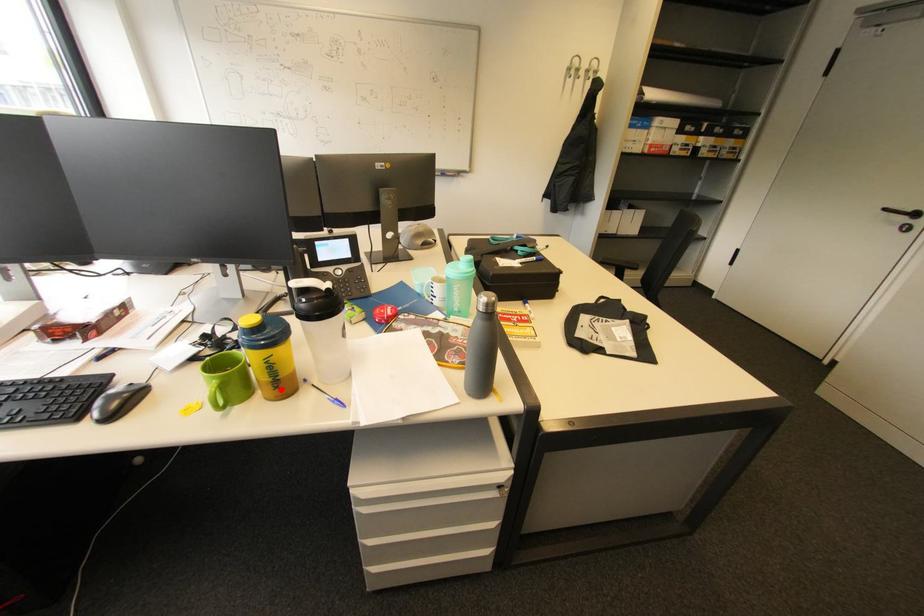
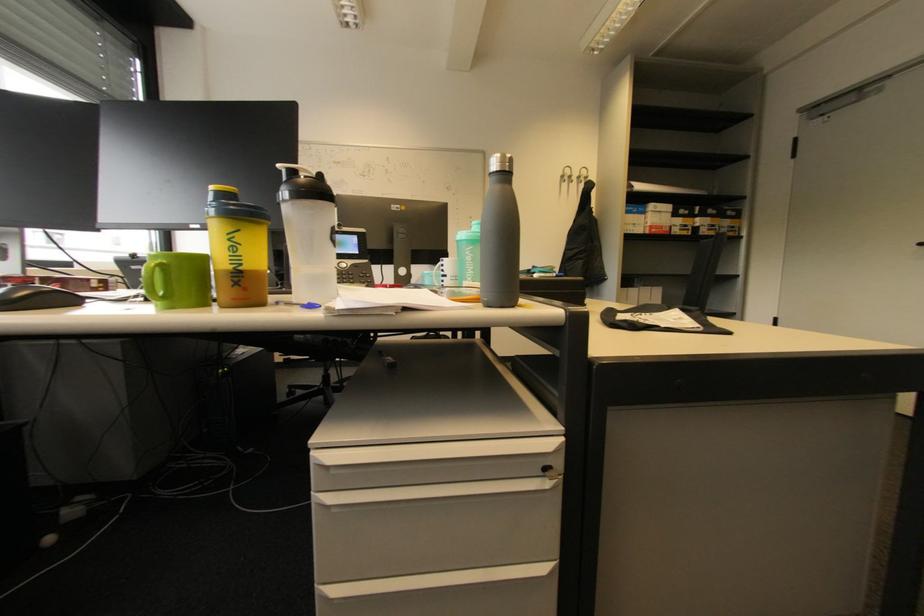
Find the pixel in the second image that matches the highlighted location in the first image.

(239, 286)